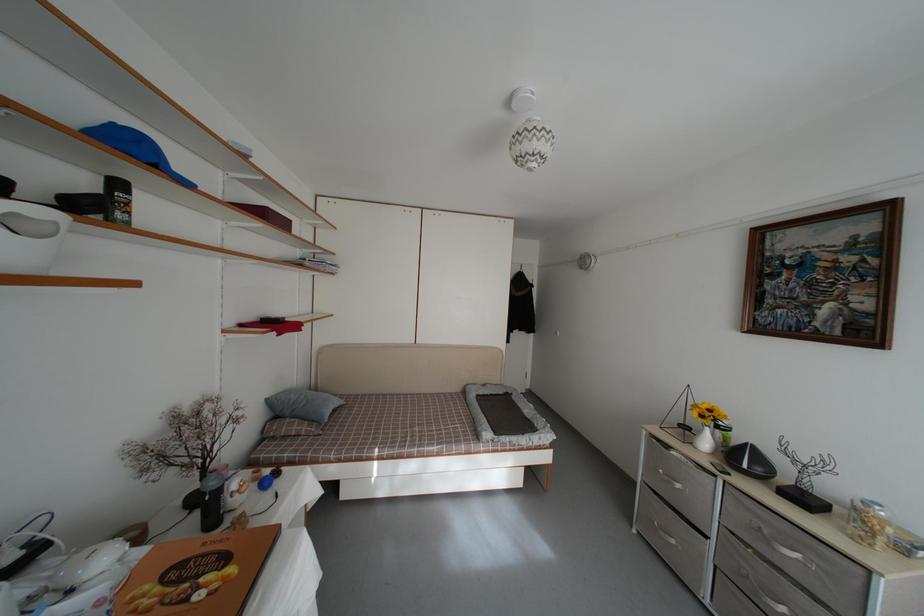
Where would you lift the white ceramic vase? Please return your answer as a coordinate pair (x, y).

(704, 440)